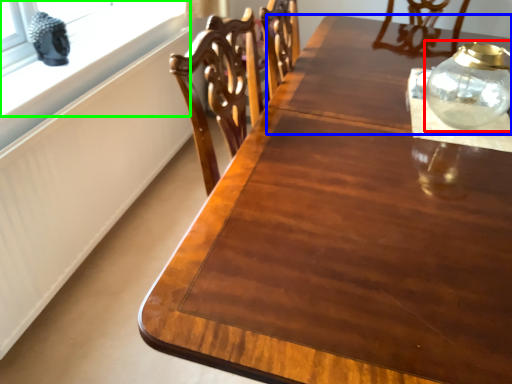
Question: Considering the real-world distances, which object is farthest from glass vase (highlighted by a red box)? round table (highlighted by a blue box) or window (highlighted by a green box)?

Choices:
 (A) round table
 (B) window

Answer: (B)